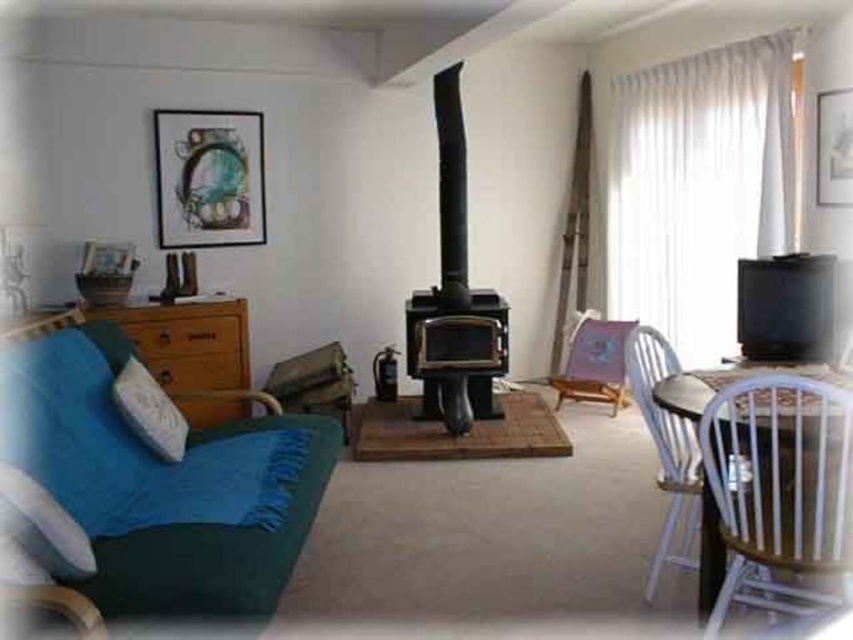
Who is positioned more to the right, white soft pillow at lower left or dark brown wooden table at right?

dark brown wooden table at right is more to the right.

You are a GUI agent. You are given a task and a screenshot of the screen. Output one action in this format:
    pyautogui.click(x=<x>, y=<y>)
    Task: Click on the white soft pillow at lower left
    
    Given the screenshot: What is the action you would take?
    pyautogui.click(x=42, y=525)

Is wooden spindle back chair at right above wooden folding chair at center?

Actually, wooden spindle back chair at right is below wooden folding chair at center.

Which is more to the right, wooden spindle back chair at right or wooden folding chair at center?

wooden folding chair at center is more to the right.

Between point (633, 333) and point (618, 346), which one is positioned behind?

The point (618, 346) is behind.

You are a GUI agent. You are given a task and a screenshot of the screen. Output one action in this format:
    pyautogui.click(x=<x>, y=<y>)
    Task: Click on the wooden spindle back chair at right
    
    Given the screenshot: What is the action you would take?
    pyautogui.click(x=666, y=449)

Does blue fabric couch at left have a lesser height compared to dark brown wooden table at right?

Incorrect, blue fabric couch at left's height does not fall short of dark brown wooden table at right's.

Can you confirm if blue fabric couch at left is taller than dark brown wooden table at right?

Indeed, blue fabric couch at left has a greater height compared to dark brown wooden table at right.

Is point (131, 508) positioned behind point (666, 381)?

No, (131, 508) is in front of (666, 381).

At what (x,y) coordinates should I click in order to perform the action: click on blue fabric couch at left. Please return your answer as a coordinate pair (x, y). Looking at the image, I should click on (160, 488).